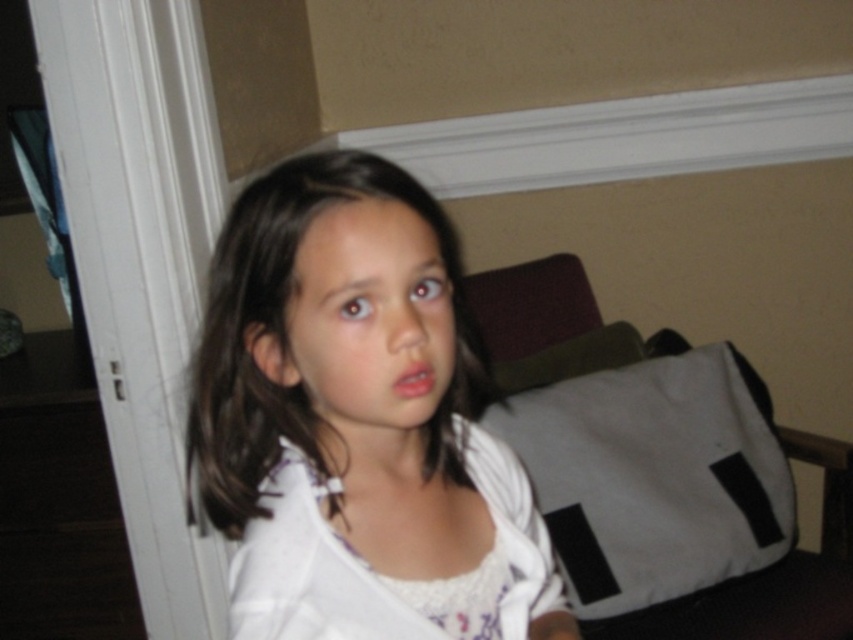
Question: Which point is farther to the camera?

Choices:
 (A) smooth white shirt at center
 (B) white textured dress at center

Answer: (B)

Question: Is the position of smooth white shirt at center more distant than that of white textured dress at center?

Choices:
 (A) yes
 (B) no

Answer: (B)

Question: Which of the following is the closest to the observer?

Choices:
 (A) (413, 369)
 (B) (549, 595)

Answer: (A)

Question: Does smooth white shirt at center appear under white textured dress at center?

Choices:
 (A) no
 (B) yes

Answer: (A)

Question: Can you confirm if smooth white shirt at center is positioned to the left of white textured dress at center?

Choices:
 (A) no
 (B) yes

Answer: (B)